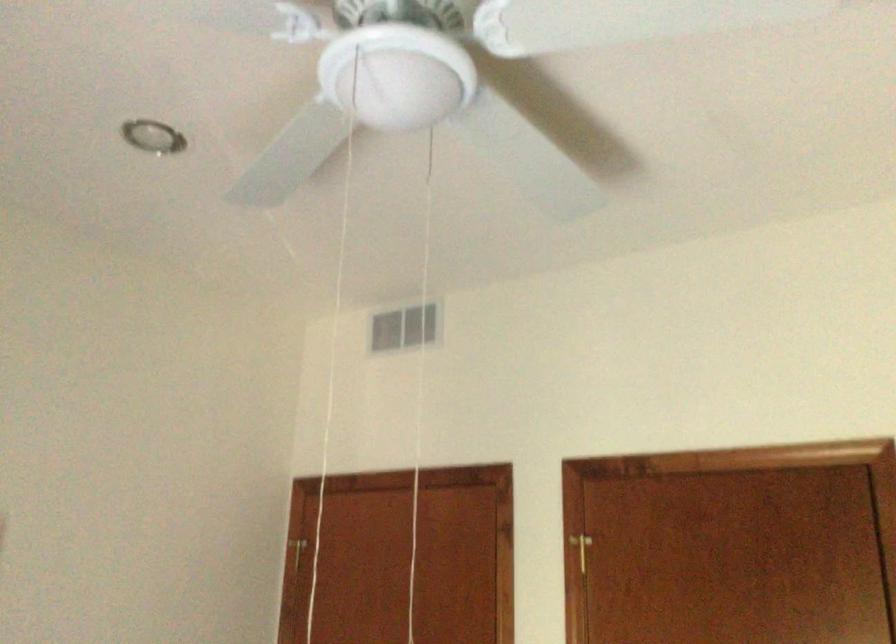
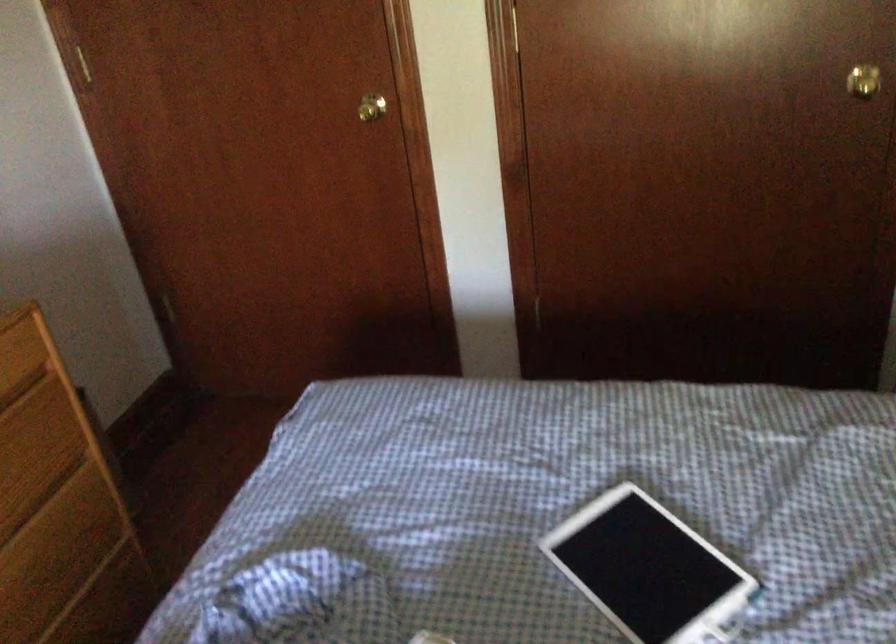
The images are taken continuously from a first-person perspective. In which direction is your viewpoint rotating?

The rotation direction of the camera is right-down.